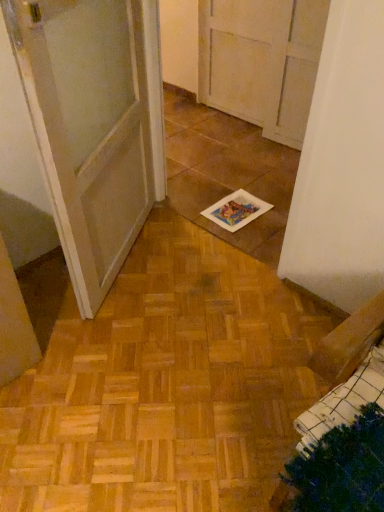
In order to click on vacant position to the left of white paper at center in this screenshot , I will do `click(198, 204)`.